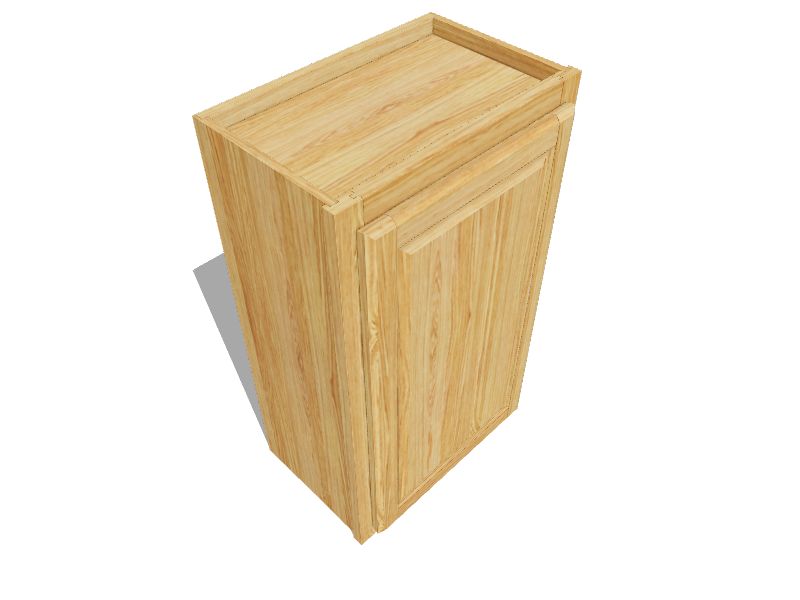
Find the location of a particular element. front of the wood box is located at coordinates (480, 340).